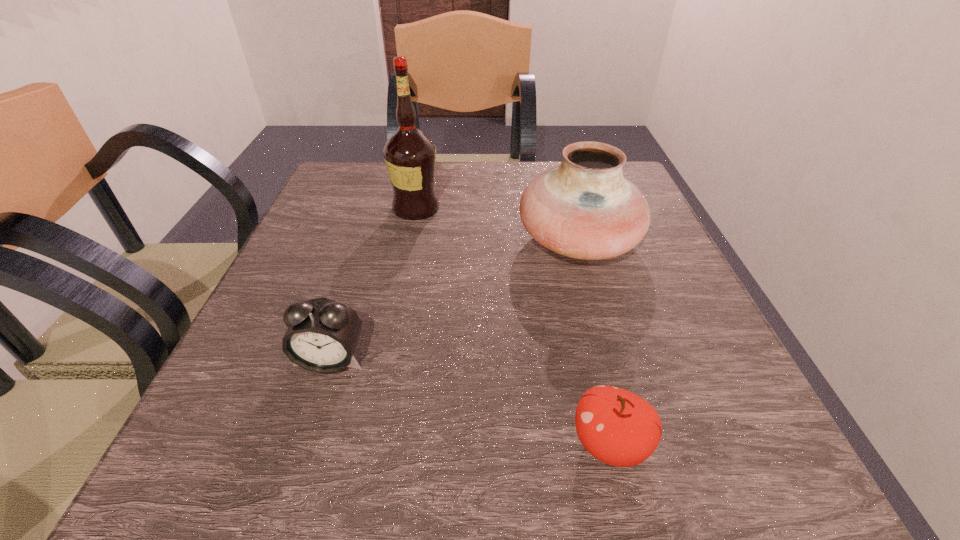
At what (x,y) coordinates should I click in order to perform the action: click on vacant space at the far left corner of the desktop. Please return your answer as a coordinate pair (x, y). Image resolution: width=960 pixels, height=540 pixels. Looking at the image, I should click on (332, 184).

Locate an element on the screen. This screenshot has width=960, height=540. vacant space at the near left corner of the desktop is located at coordinates (210, 463).

Find the location of `free space at the near right corner of the desktop`. free space at the near right corner of the desktop is located at coordinates pyautogui.click(x=697, y=457).

This screenshot has width=960, height=540. Identify the location of free point between the alarm clock and the apple. (469, 402).

I want to click on unoccupied position between the tallest object and the alarm clock, so click(x=373, y=284).

What are the coordinates of `empty space that is in between the second nearest object and the nearest object` in the screenshot? It's located at (469, 402).

Locate an element on the screen. unoccupied position between the nearest object and the alarm clock is located at coordinates (469, 402).

The height and width of the screenshot is (540, 960). Find the location of `unoccupied area between the alarm clock and the alcohol`. unoccupied area between the alarm clock and the alcohol is located at coordinates (373, 284).

Locate an element on the screen. The width and height of the screenshot is (960, 540). vacant space that's between the tallest object and the pottery is located at coordinates (497, 225).

Find the location of a particular element. This screenshot has width=960, height=540. vacant area that lies between the tallest object and the third shortest object is located at coordinates (497, 225).